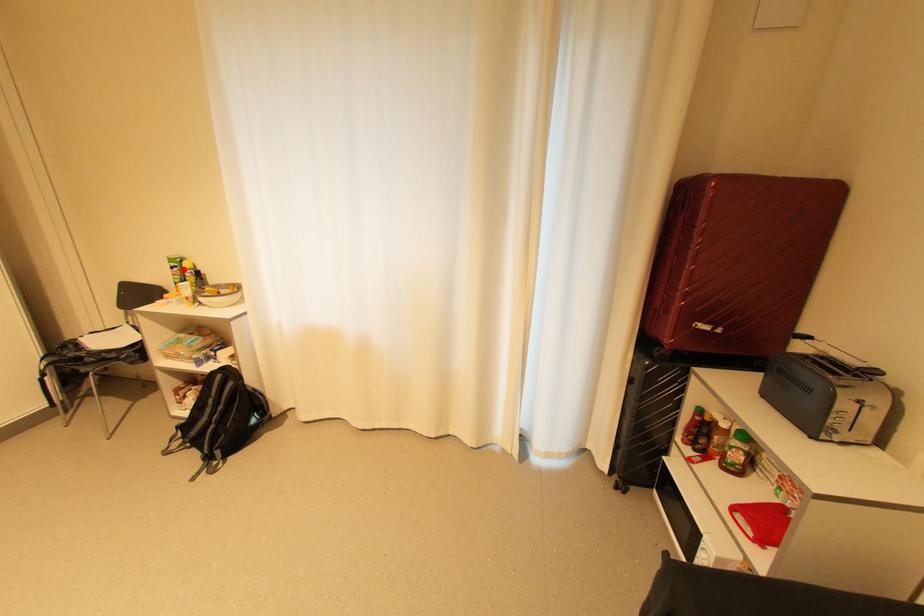
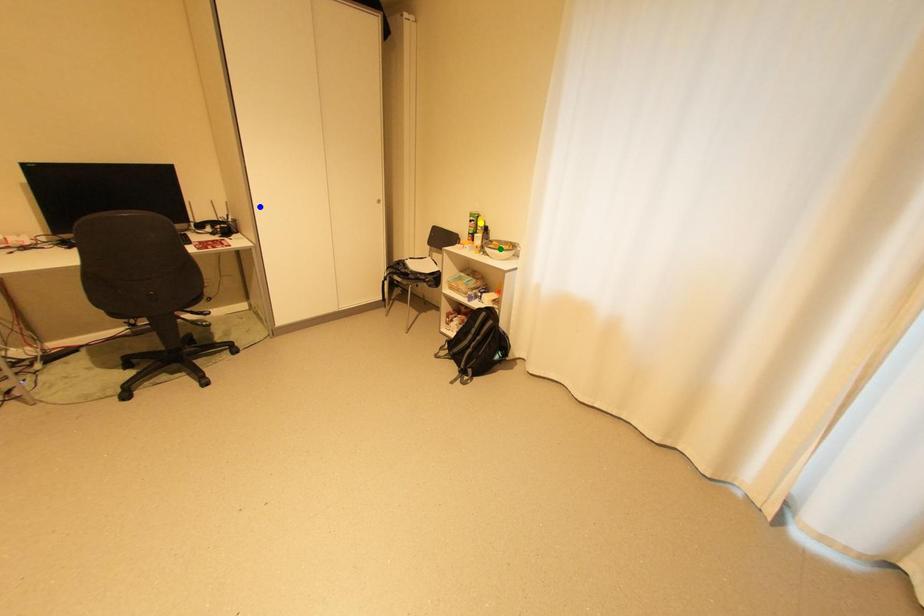
Question: I am providing you with two images of the same scene from different viewpoints. A red point is marked on the first image. You are given multiple points on the second image. Can you choose the point in image 2 that corresponds to the point in image 1?

Choices:
 (A) green point
 (B) yellow point
 (C) blue point

Answer: (B)